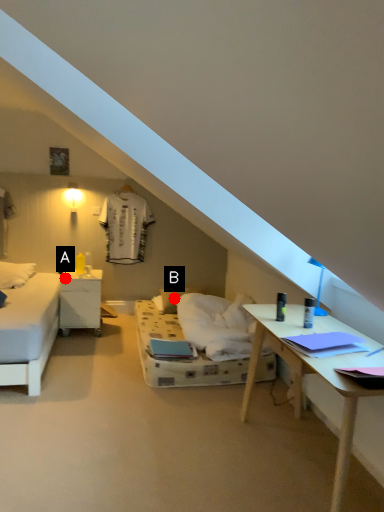
Question: Two points are circled on the image, labeled by A and B beside each circle. Among these points, which one is farthest from the camera?

Choices:
 (A) A is further
 (B) B is further

Answer: (B)